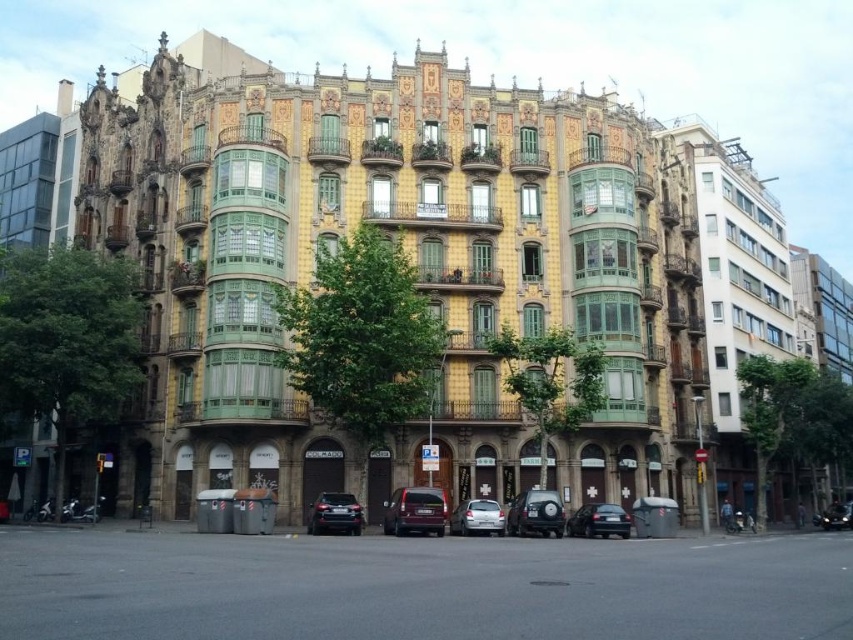
You are standing in front of the building and want to park your car. The parking spot is at point (x=415, y=512). Is there an object at that location?

Yes, there is a satin burgundy suv at center at point (x=415, y=512), so the parking spot is occupied.

You are a delivery person trying to park your van between the satin burgundy suv at center and the shiny black sedan at lower center. Can your van fit in the space between them?

The satin burgundy suv at center is larger than the shiny black sedan at lower center. However, without knowing the exact dimensions of the space between them or the size of your van, it is impossible to determine if it will fit. Please measure the available space before attempting to park.